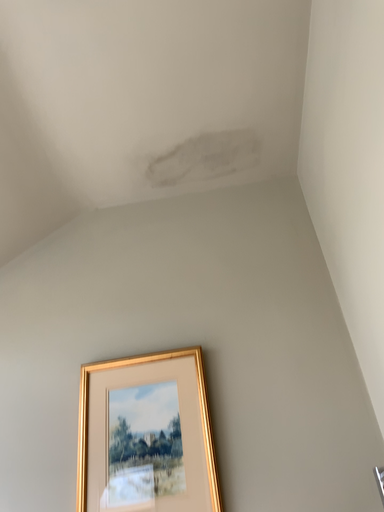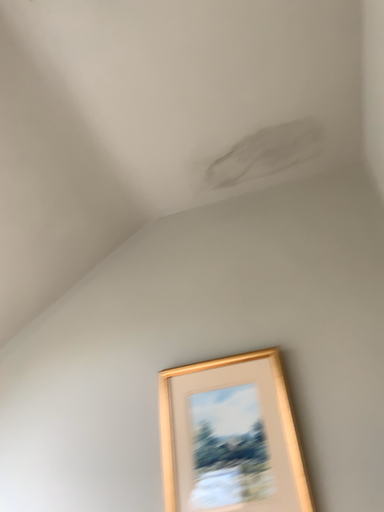
Question: Which way did the camera rotate in the video?

Choices:
 (A) rotated right
 (B) rotated left

Answer: (B)